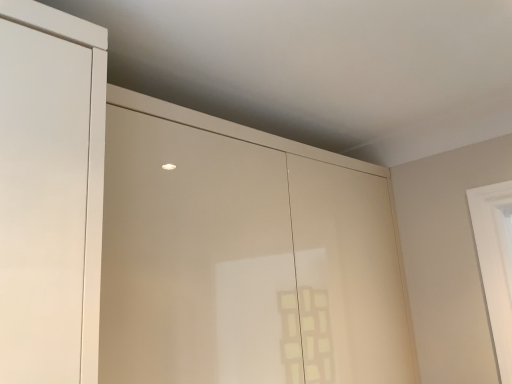
What are the coordinates of `matte white dresser at upper center` in the screenshot? It's located at (243, 263).

What do you see at coordinates (243, 263) in the screenshot?
I see `matte white dresser at upper center` at bounding box center [243, 263].

At what (x,y) coordinates should I click in order to perform the action: click on matte white dresser at upper center. Please return your answer as a coordinate pair (x, y). The image size is (512, 384). Looking at the image, I should click on (243, 263).